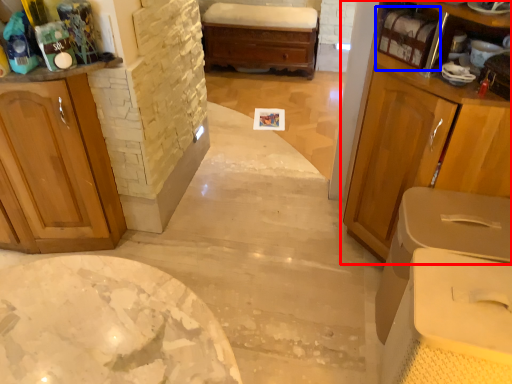
Question: Which point is further to the camera, cabinetry (highlighted by a red box) or shelf (highlighted by a blue box)?

Choices:
 (A) cabinetry
 (B) shelf

Answer: (B)